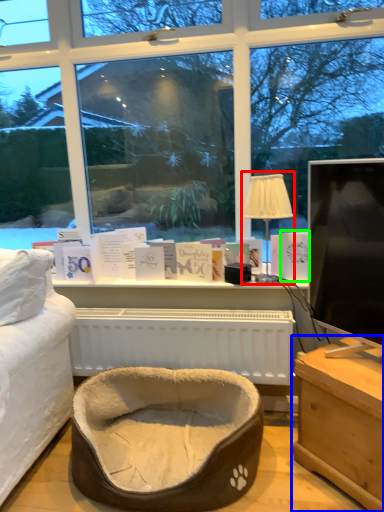
Question: Estimate the real-world distances between objects in this image. Which object is farther from table lamp (highlighted by a red box), table (highlighted by a blue box) or book (highlighted by a green box)?

Choices:
 (A) table
 (B) book

Answer: (A)